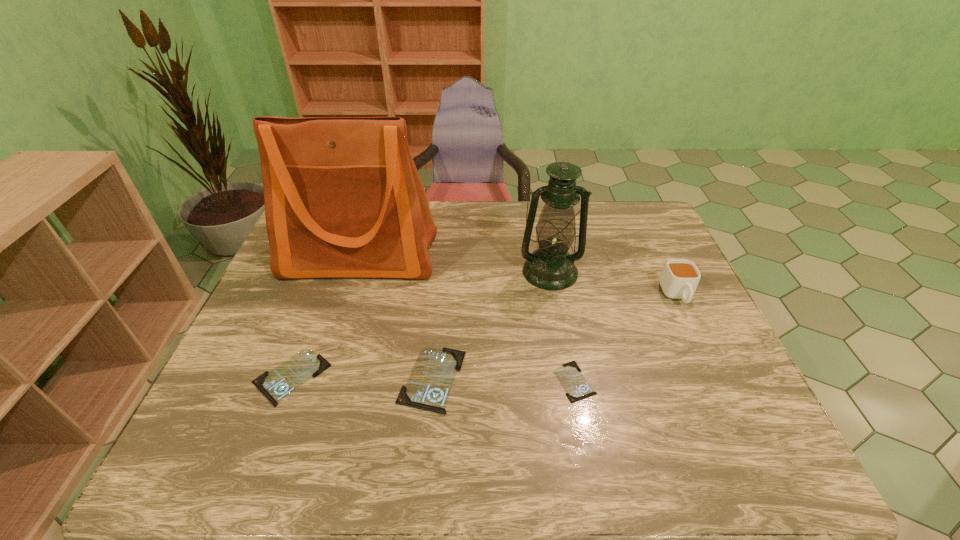
Where is `the fifth tallest object`? This screenshot has width=960, height=540. the fifth tallest object is located at coordinates (275, 385).

This screenshot has width=960, height=540. I want to click on the second shortest identity card, so click(275, 385).

Locate an element on the screen. the second identity card from left to right is located at coordinates (428, 387).

Identify the location of the shortest object. The width and height of the screenshot is (960, 540). (577, 388).

This screenshot has width=960, height=540. I want to click on the rightmost identity card, so click(x=577, y=388).

The width and height of the screenshot is (960, 540). Find the location of `shopping bag`. shopping bag is located at coordinates (343, 199).

Find the location of a particular element. This screenshot has height=540, width=960. the second tallest object is located at coordinates (551, 267).

At what (x,y) coordinates should I click in order to perform the action: click on cup. Please return your answer as a coordinate pair (x, y). The width and height of the screenshot is (960, 540). Looking at the image, I should click on (679, 280).

Find the location of a particular element. the fourth shortest object is located at coordinates (679, 280).

Locate an element on the screen. The image size is (960, 540). vacant space located 0.170m on the back of the fifth tallest object is located at coordinates (320, 301).